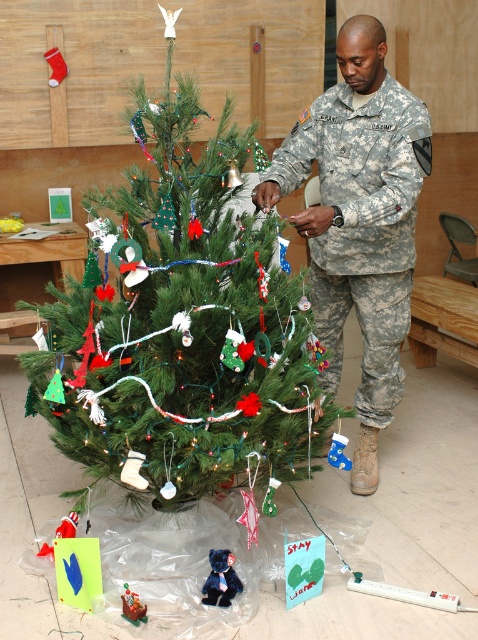
Between point (206, 588) and point (145, 612), which one is positioned in front?

Point (145, 612)

Is velvety blue teddy bear at center thinner than metallic silver sleigh at center?

Incorrect, velvety blue teddy bear at center's width is not less than metallic silver sleigh at center's.

Describe the element at coordinates (220, 579) in the screenshot. I see `velvety blue teddy bear at center` at that location.

What are the coordinates of `velvety blue teddy bear at center` in the screenshot? It's located at (220, 579).

Does point (327, 216) lie in front of point (142, 605)?

No.

Is camouflage uniform at center to the left of metallic silver sleigh at center from the viewer's perspective?

Incorrect, camouflage uniform at center is not on the left side of metallic silver sleigh at center.

Does point (314, 209) come closer to viewer compared to point (126, 616)?

No.

The height and width of the screenshot is (640, 478). Identify the location of camouflage uniform at center. (358, 220).

Is point (376, 259) more distant than point (221, 580)?

That is True.

Is point (402, 248) positioned in front of point (228, 564)?

No, it is not.

Where is `camouflage uniform at center`? Image resolution: width=478 pixels, height=640 pixels. camouflage uniform at center is located at coordinates (358, 220).